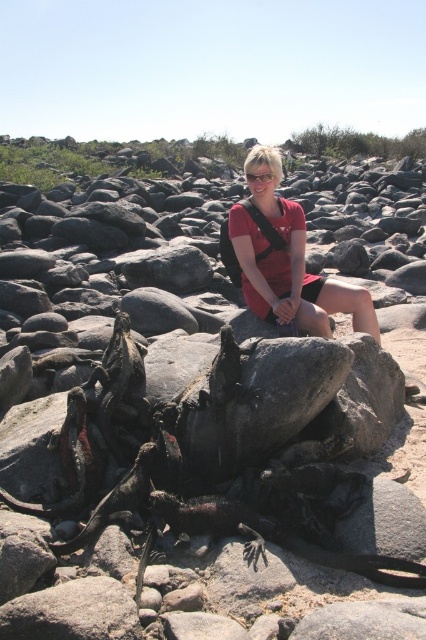
You are a photographer trying to capture a closeup of the clear plastic goggles at center. However, the matte red dress at center is blocking your view. Can you move the dress to get a clear shot?

The matte red dress at center is in front of the clear plastic goggles at center, so moving the dress would allow you to get a clear shot of the goggles.

You are a photographer trying to capture a shot of the matte red dress at center while avoiding the marine iguanas in the foreground. Based on their positions, can you determine if the dress is positioned behind or in front of the rocks with the iguanas?

The matte red dress at center is located at point (287, 260), which places it behind the rocks with the marine iguanas in the foreground, so it should be visible without obstruction.